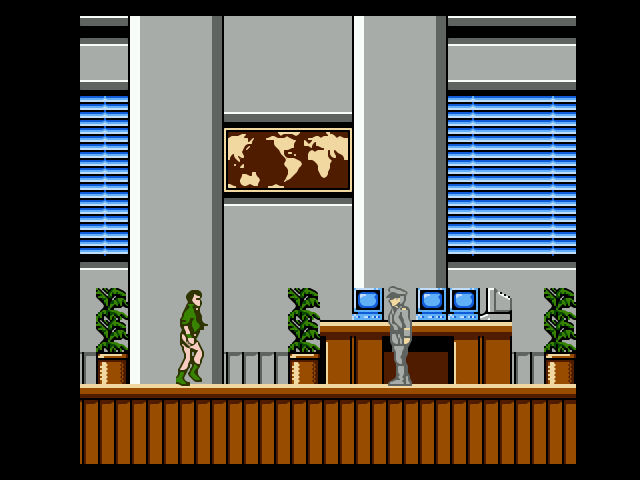
Locate an element on the screen. window is located at coordinates (86, 175), (524, 150).